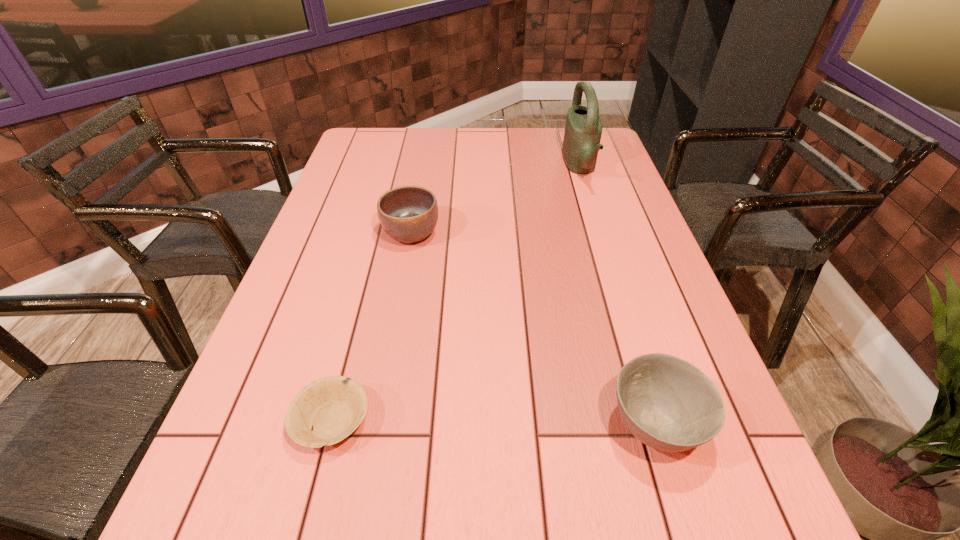
Locate an element on the screen. The height and width of the screenshot is (540, 960). free location located on the right of the shortest object is located at coordinates (479, 421).

The height and width of the screenshot is (540, 960). What are the coordinates of `object that is positioned at the far edge` in the screenshot? It's located at (583, 129).

This screenshot has height=540, width=960. In order to click on object at the left edge in this screenshot , I will do (333, 407).

Where is `watering can that is at the right edge`? The image size is (960, 540). watering can that is at the right edge is located at coordinates (583, 129).

The width and height of the screenshot is (960, 540). Identify the location of bowl situated at the right edge. (667, 403).

The width and height of the screenshot is (960, 540). What are the coordinates of `object that is at the far right corner` in the screenshot? It's located at (583, 129).

In order to click on vacant region at the far edge of the desktop in this screenshot , I will do `click(501, 141)`.

Locate an element on the screen. The height and width of the screenshot is (540, 960). free space at the left edge of the desktop is located at coordinates (265, 336).

At what (x,y) coordinates should I click in order to perform the action: click on free location at the right edge. Please return your answer as a coordinate pair (x, y). The width and height of the screenshot is (960, 540). Looking at the image, I should click on click(637, 222).

Locate an element on the screen. The image size is (960, 540). free space at the far right corner of the desktop is located at coordinates (564, 134).